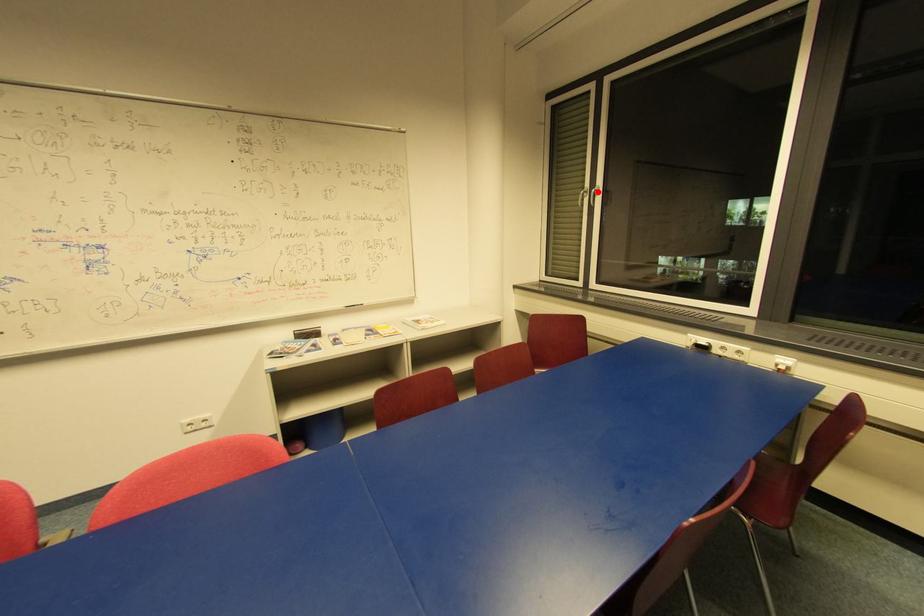
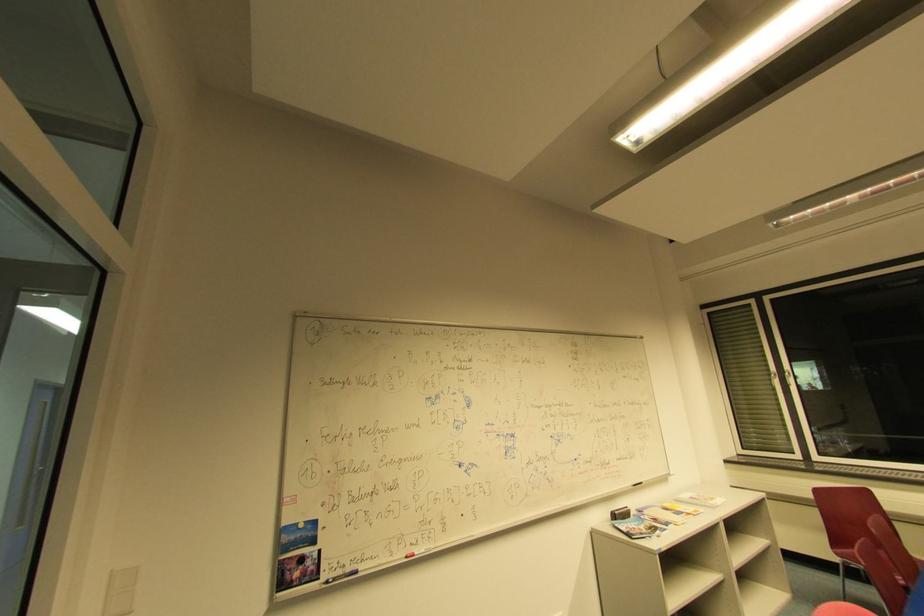
The point at the highlighted location is marked in the first image. Where is the corresponding point in the second image?

(791, 375)